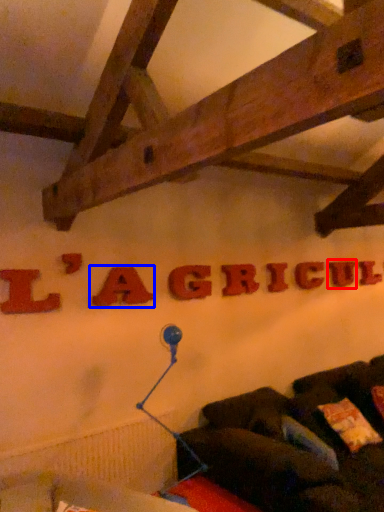
Question: Which point is closer to the camera, letter (highlighted by a red box) or letter (highlighted by a blue box)?

Choices:
 (A) letter
 (B) letter

Answer: (B)